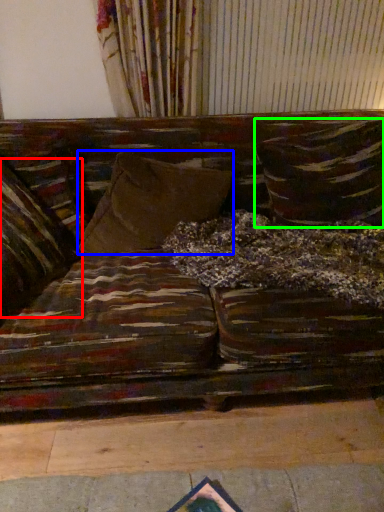
Question: Which is nearer to the pillow (highlighted by a red box)? pillow (highlighted by a blue box) or pillow (highlighted by a green box).

Choices:
 (A) pillow
 (B) pillow

Answer: (A)